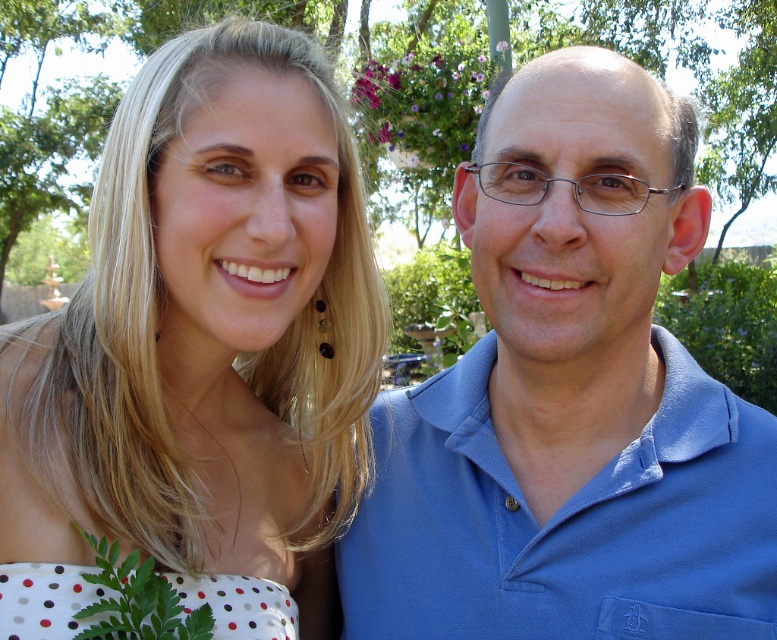
You are a photographer trying to capture a photo of both the white dotted dress at left and the blue cotton shirt at right. Since you want both items to be fully visible in the frame, which one should you focus on first to ensure proper focus?

The white dotted dress at left is above the blue cotton shirt at right, so you should focus on the white dotted dress at left first to ensure both are in focus as it is closer to the camera.

You are a fashion designer observing the image. You need to decide which item has a greater width between the white dotted dress at left and the white polka dot fabric at lower left. Which one is wider?

The white dotted dress at left is wider than the white polka dot fabric at lower left according to the description.

You are a photographer setting up a shot of the scene described. You want to ensure the white dotted dress at left is in focus while keeping the background slightly blurred. Given the dress is 96.89 centimeters from the camera, what should your minimum focusing distance be?

To ensure the white dotted dress at left is in focus, your minimum focusing distance should be set to at least 96.89 centimeters, as that is the distance of the white dotted dress at left from the camera.